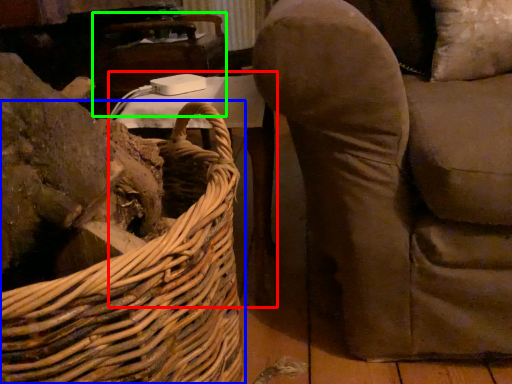
Question: Considering the real-world distances, which object is closest to table (highlighted by a red box)? picnic basket (highlighted by a blue box) or table (highlighted by a green box).

Choices:
 (A) picnic basket
 (B) table

Answer: (A)